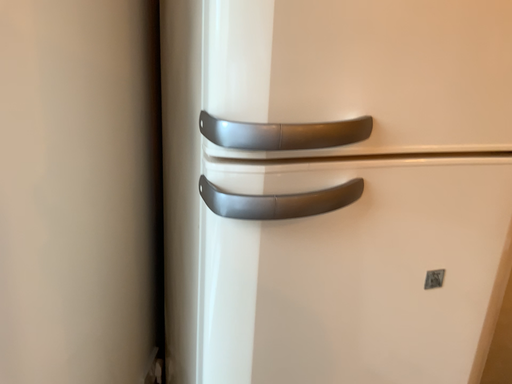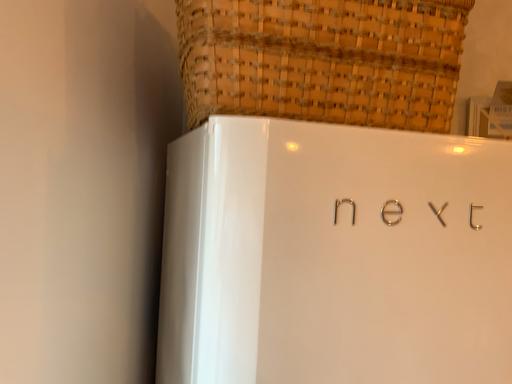
Question: How did the camera likely rotate when shooting the video?

Choices:
 (A) rotated upward
 (B) rotated downward

Answer: (A)